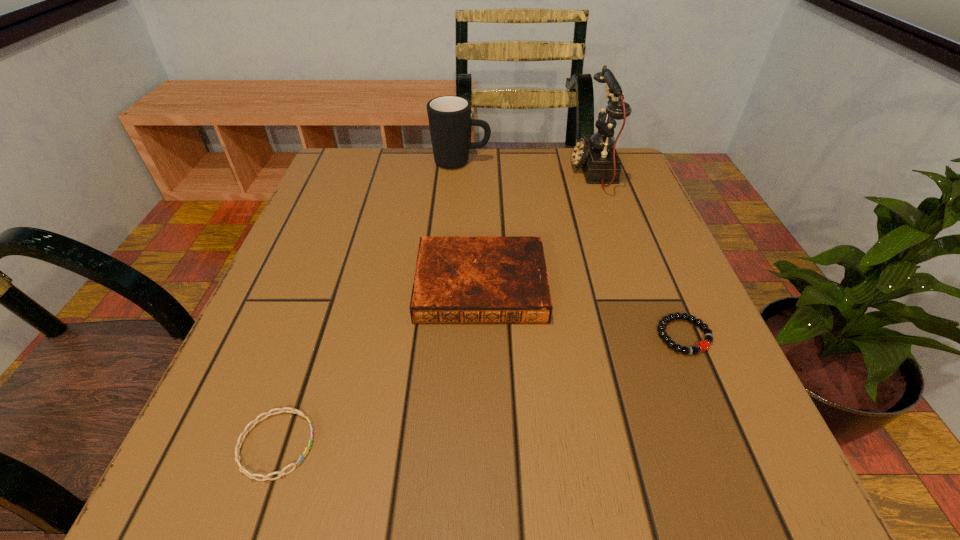
Locate an element on the screen. The width and height of the screenshot is (960, 540). free region located 0.080m on the spine side of the Bible is located at coordinates (481, 366).

Where is `vacant space located 0.300m on the back of the right bracelet`? The image size is (960, 540). vacant space located 0.300m on the back of the right bracelet is located at coordinates (631, 210).

This screenshot has width=960, height=540. Find the location of `free point located on the surface of the left bracelet showing star-shaped elements`. free point located on the surface of the left bracelet showing star-shaped elements is located at coordinates (398, 444).

Find the location of `telephone present at the far edge`. telephone present at the far edge is located at coordinates (595, 155).

Identify the location of mug located in the far edge section of the desktop. The image size is (960, 540). (449, 117).

Where is `object that is at the near edge`? This screenshot has width=960, height=540. object that is at the near edge is located at coordinates coord(242,469).

I want to click on object that is at the left edge, so click(x=242, y=469).

Where is `telephone located in the right edge section of the desktop`? The width and height of the screenshot is (960, 540). telephone located in the right edge section of the desktop is located at coordinates (595, 155).

This screenshot has width=960, height=540. In order to click on bracelet at the right edge in this screenshot , I will do `click(703, 345)`.

At what (x,y) coordinates should I click in order to perform the action: click on object that is positioned at the near left corner. Please return your answer as a coordinate pair (x, y). Image resolution: width=960 pixels, height=540 pixels. Looking at the image, I should click on (242, 469).